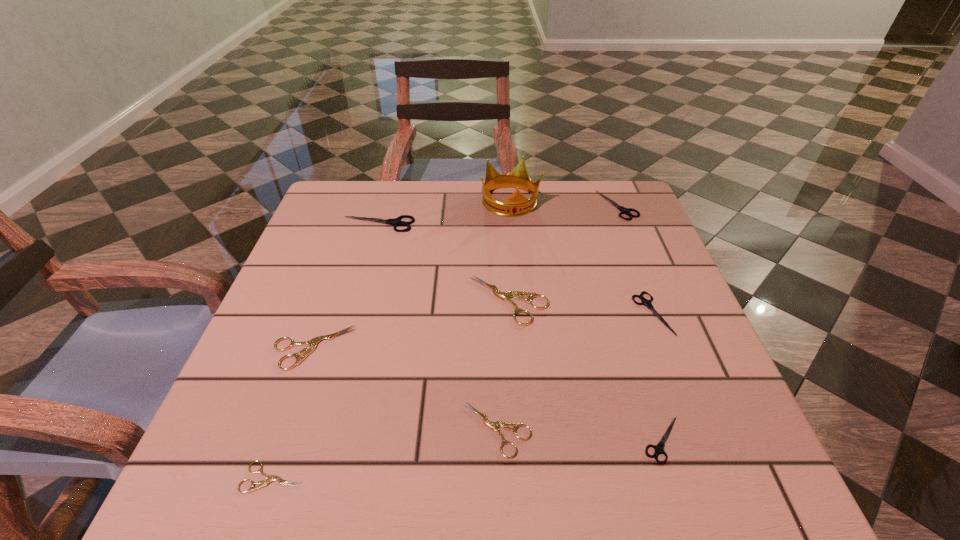
Identify the location of vacant area at the near right corner. (744, 453).

Where is `free space between the smallest black shears and the third nearest beige shears`? Image resolution: width=960 pixels, height=540 pixels. free space between the smallest black shears and the third nearest beige shears is located at coordinates pyautogui.click(x=488, y=394).

In order to click on unoccupied position between the second farthest beige shears and the second nearest beige shears in this screenshot , I will do `click(405, 389)`.

Locate an element on the screen. The image size is (960, 540). blank region between the farthest beige shears and the biggest black shears is located at coordinates (444, 262).

Find the location of a particular element. vacant area between the shortest shears and the smallest black shears is located at coordinates (468, 458).

At what (x,y) coordinates should I click in order to perform the action: click on free space between the third farthest black shears and the gold crown. Please return your answer as a coordinate pair (x, y). This screenshot has height=540, width=960. Looking at the image, I should click on (582, 258).

The height and width of the screenshot is (540, 960). I want to click on vacant area that lies between the second nearest black shears and the second farthest beige shears, so click(483, 330).

Where is `empty space between the third biggest black shears and the smallest black shears`? The image size is (960, 540). empty space between the third biggest black shears and the smallest black shears is located at coordinates (658, 376).

I want to click on vacant space in between the third biggest beige shears and the second biggest black shears, so click(x=558, y=318).

At what (x,y) coordinates should I click in order to perform the action: click on free space between the third nearest beige shears and the tallest object. Please return your answer as a coordinate pair (x, y). Looking at the image, I should click on (412, 275).